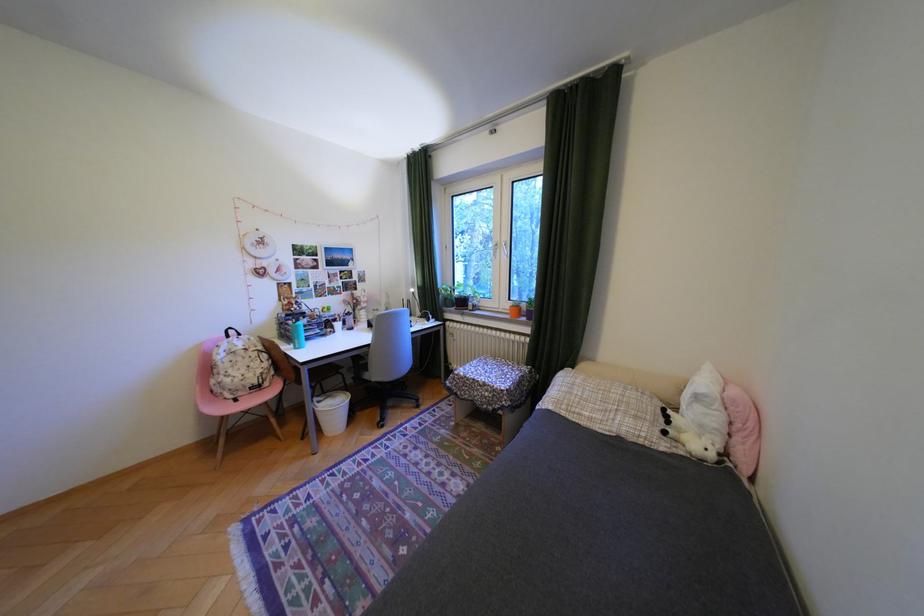
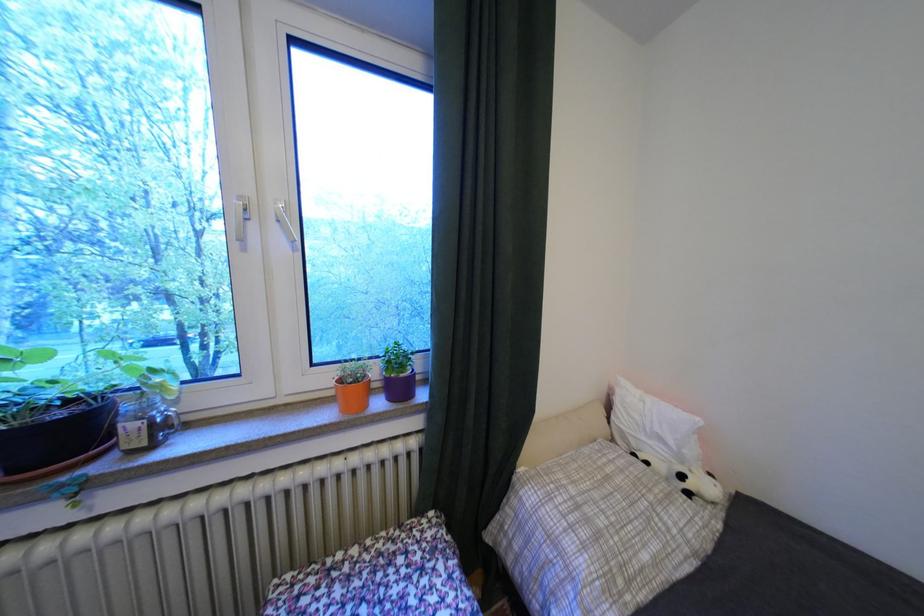
Find the pixel in the second image that matches (602,419) in the first image.

(667, 562)